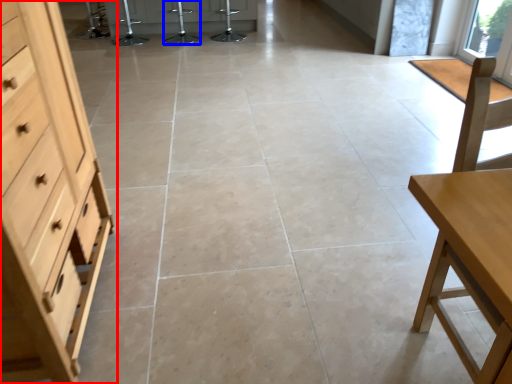
Question: Which of the following is the farthest to the observer, chest of drawers (highlighted by a red box) or bar stool (highlighted by a blue box)?

Choices:
 (A) chest of drawers
 (B) bar stool

Answer: (B)